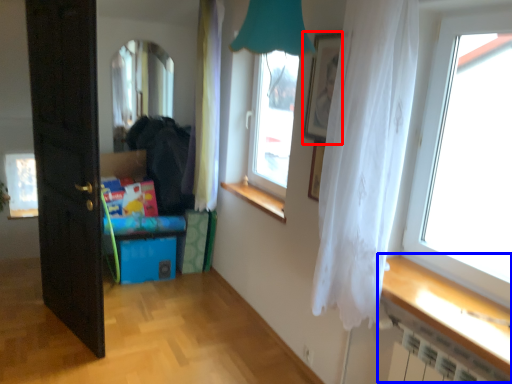
Question: Which point is closer to the camera, picture frame (highlighted by a red box) or table (highlighted by a blue box)?

Choices:
 (A) picture frame
 (B) table

Answer: (B)